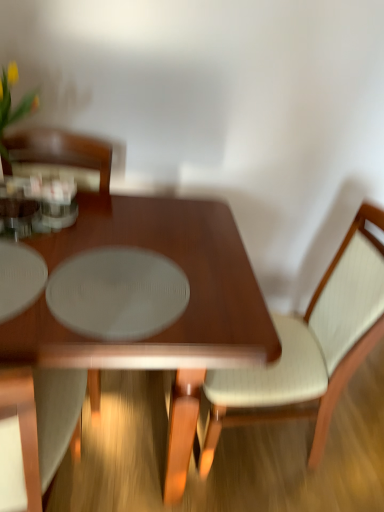
Question: Is white fabric chair at left, acting as the 2th chair starting from the right, bigger than shiny brown table at center?

Choices:
 (A) yes
 (B) no

Answer: (B)

Question: From a real-world perspective, is white fabric chair at left, the 1th chair from the left, located beneath shiny brown table at center?

Choices:
 (A) yes
 (B) no

Answer: (B)

Question: Does white fabric chair at left, the 1th chair from the left, appear on the left side of shiny brown table at center?

Choices:
 (A) yes
 (B) no

Answer: (A)

Question: Can you confirm if white fabric chair at left, acting as the 2th chair starting from the right, is thinner than shiny brown table at center?

Choices:
 (A) no
 (B) yes

Answer: (B)

Question: Considering the relative positions of white fabric chair at left, the 1th chair from the left, and shiny brown table at center in the image provided, is white fabric chair at left, the 1th chair from the left, in front of shiny brown table at center?

Choices:
 (A) no
 (B) yes

Answer: (B)

Question: Is point (182, 241) positioned closer to the camera than point (372, 291)?

Choices:
 (A) farther
 (B) closer

Answer: (A)

Question: Is shiny brown table at center wider or thinner than light beige fabric chair at center, placed as the 2th chair when sorted from left to right?

Choices:
 (A) wide
 (B) thin

Answer: (A)

Question: Relative to light beige fabric chair at center, placed as the 2th chair when sorted from left to right, is shiny brown table at center in front or behind?

Choices:
 (A) behind
 (B) front

Answer: (B)

Question: From their relative heights in the image, would you say shiny brown table at center is taller or shorter than light beige fabric chair at center, positioned as the first chair in right-to-left order?

Choices:
 (A) tall
 (B) short

Answer: (B)

Question: Considering the positions of point (36, 264) and point (170, 220), is point (36, 264) closer or farther from the camera than point (170, 220)?

Choices:
 (A) closer
 (B) farther

Answer: (A)

Question: Do you think white fabric chair at left, the 1th chair from the left, is within shiny brown table at center, or outside of it?

Choices:
 (A) outside
 (B) inside

Answer: (B)

Question: Looking at the image, does white fabric chair at left, acting as the 2th chair starting from the right, seem bigger or smaller compared to shiny brown table at center?

Choices:
 (A) small
 (B) big

Answer: (A)

Question: Considering the relative positions of white fabric chair at left, the 1th chair from the left, and shiny brown table at center in the image provided, is white fabric chair at left, the 1th chair from the left, to the left or to the right of shiny brown table at center?

Choices:
 (A) right
 (B) left

Answer: (B)

Question: From the image's perspective, is light beige fabric chair at center, placed as the 2th chair when sorted from left to right, located above or below shiny brown table at center?

Choices:
 (A) above
 (B) below

Answer: (A)

Question: From a real-world perspective, is light beige fabric chair at center, placed as the 2th chair when sorted from left to right, physically located above or below shiny brown table at center?

Choices:
 (A) above
 (B) below

Answer: (A)